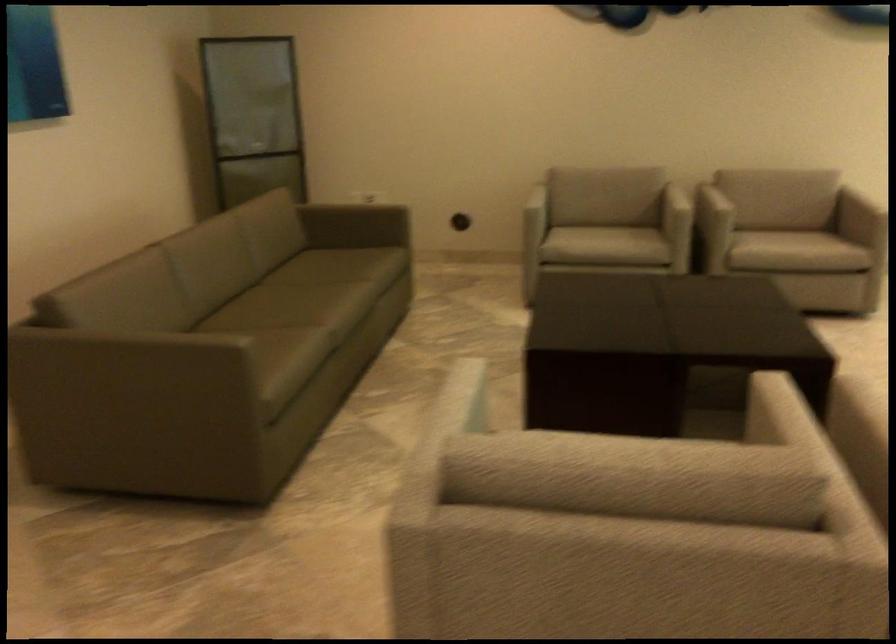
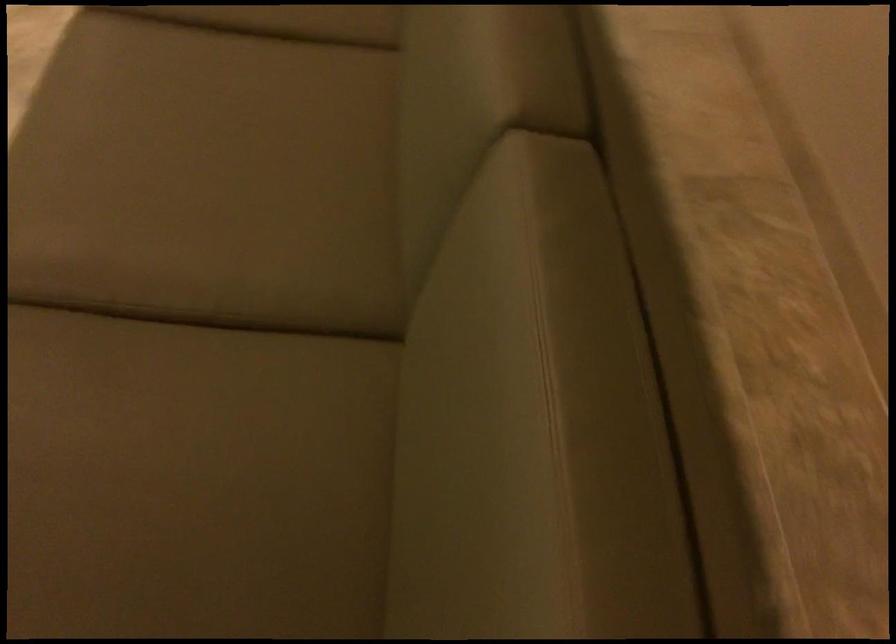
In the second image, find the point that corresponds to point 303,278 in the first image.

(211, 339)